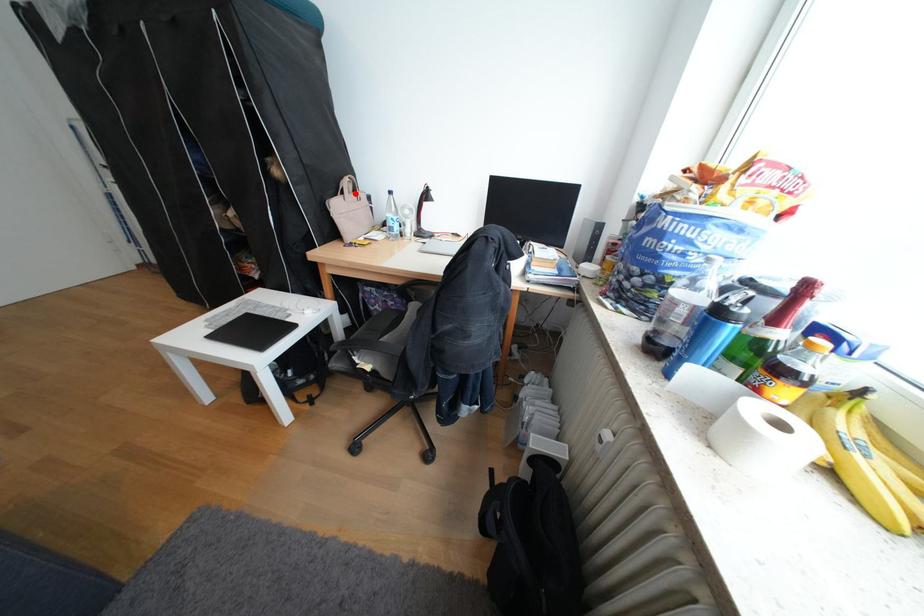
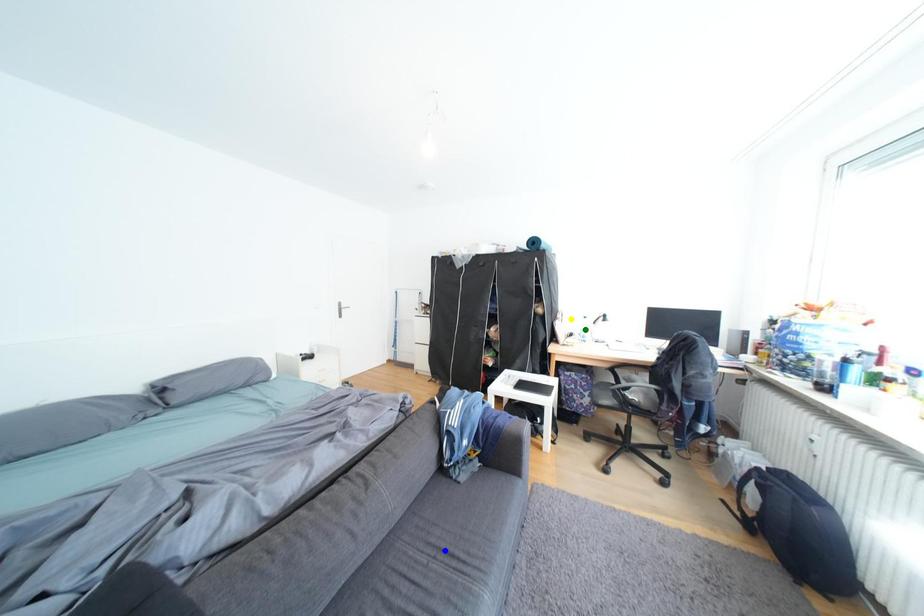
Question: I am providing you with two images of the same scene from different viewpoints. A red point is marked on the first image. You are given multiple points on the second image. Can you choose the point in image 2 that corresponds to the point in image 1?

Choices:
 (A) green point
 (B) blue point
 (C) yellow point

Answer: (C)